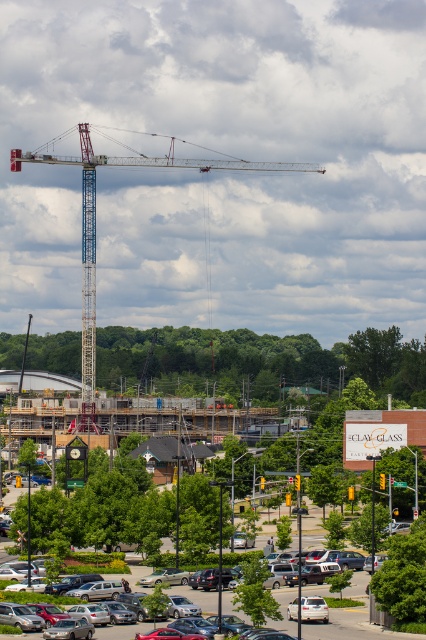
Question: Is silver metallic sedan at lower center smaller than white matte car at center?

Choices:
 (A) no
 (B) yes

Answer: (A)

Question: Observing the image, what is the correct spatial positioning of silver metallic sedan at lower center in reference to white matte car at center?

Choices:
 (A) right
 (B) left

Answer: (B)

Question: Estimate the real-world distances between objects in this image. Which object is closer to the blue metallic crane at upper left?

Choices:
 (A) white matte car at center
 (B) silver metallic sedan at lower center

Answer: (B)

Question: Is blue metallic crane at upper left to the left of white matte car at center from the viewer's perspective?

Choices:
 (A) yes
 (B) no

Answer: (A)

Question: Which point is farther to the camera?

Choices:
 (A) blue metallic crane at upper left
 (B) white matte car at center
 (C) silver metallic sedan at lower center

Answer: (A)

Question: Which point appears closest to the camera in this image?

Choices:
 (A) (85, 147)
 (B) (354, 589)
 (C) (311, 604)

Answer: (C)